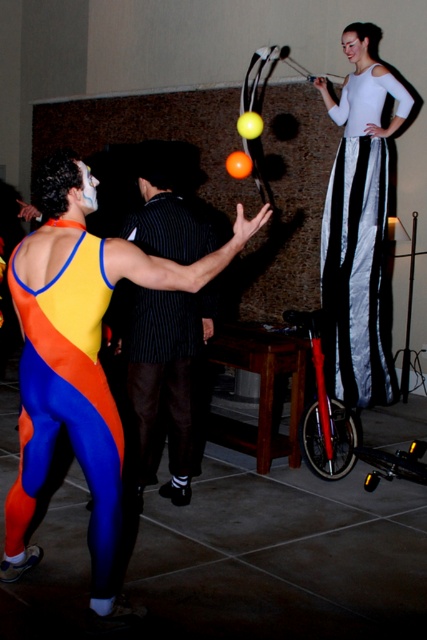
Is white matte/uniform at center further to the viewer compared to white satin pants at upper right?

No.

Can you confirm if white matte/uniform at center is shorter than white satin pants at upper right?

Indeed, white matte/uniform at center has a lesser height compared to white satin pants at upper right.

In order to click on white matte/uniform at center in this screenshot , I will do pyautogui.click(x=81, y=362).

Does white matte/uniform at center have a lesser width compared to neon spandex suit at center?

In fact, white matte/uniform at center might be wider than neon spandex suit at center.

Between white matte/uniform at center and neon spandex suit at center, which one has less height?

neon spandex suit at center is shorter.

Does point (58, 316) lie in front of point (58, 413)?

Yes, point (58, 316) is in front of point (58, 413).

Identify the location of white matte/uniform at center. (81, 362).

Does white matte/uniform at center appear under black striped suit at center?

Indeed, white matte/uniform at center is positioned under black striped suit at center.

Does white matte/uniform at center lie behind black striped suit at center?

No, white matte/uniform at center is in front of black striped suit at center.

Which is behind, point (25, 316) or point (134, 476)?

Positioned behind is point (134, 476).

Image resolution: width=427 pixels, height=640 pixels. In order to click on white matte/uniform at center in this screenshot , I will do `click(81, 362)`.